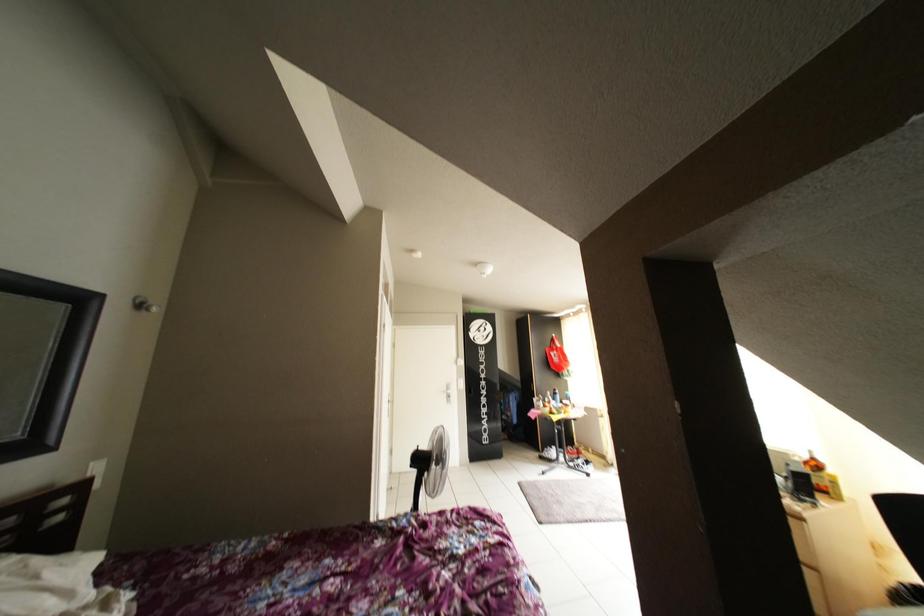
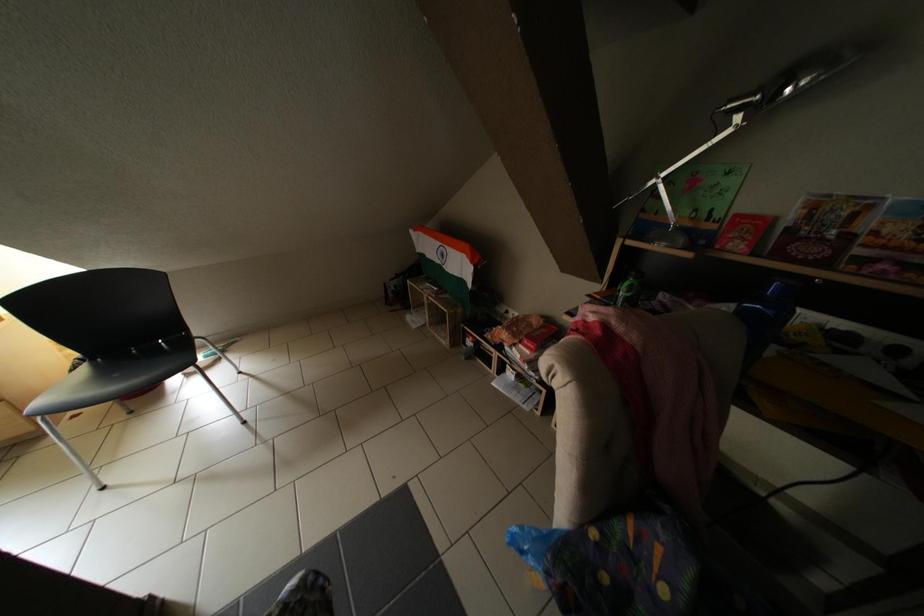
Consider the image. First-person continuous shooting, in which direction is the camera rotating?

The camera rotated toward right-down.